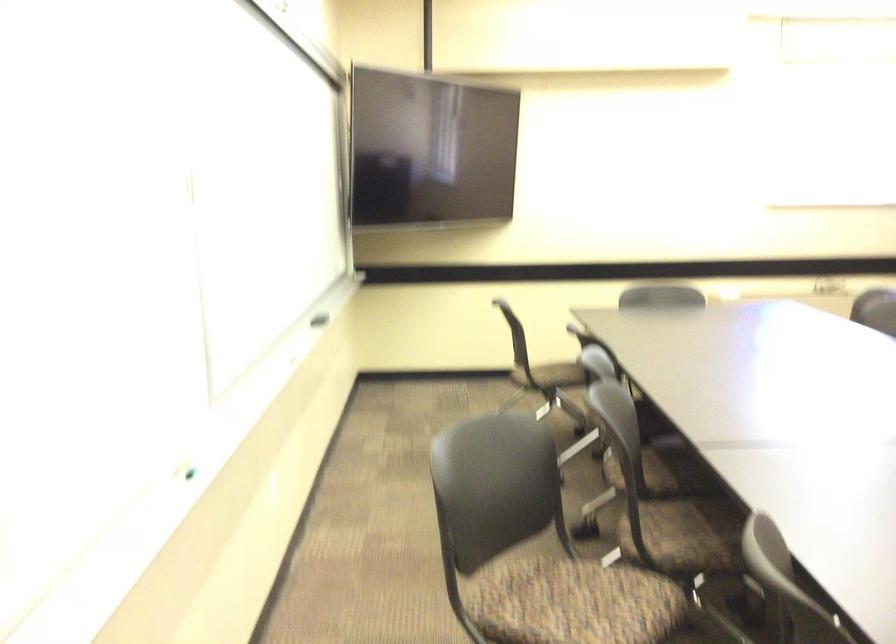
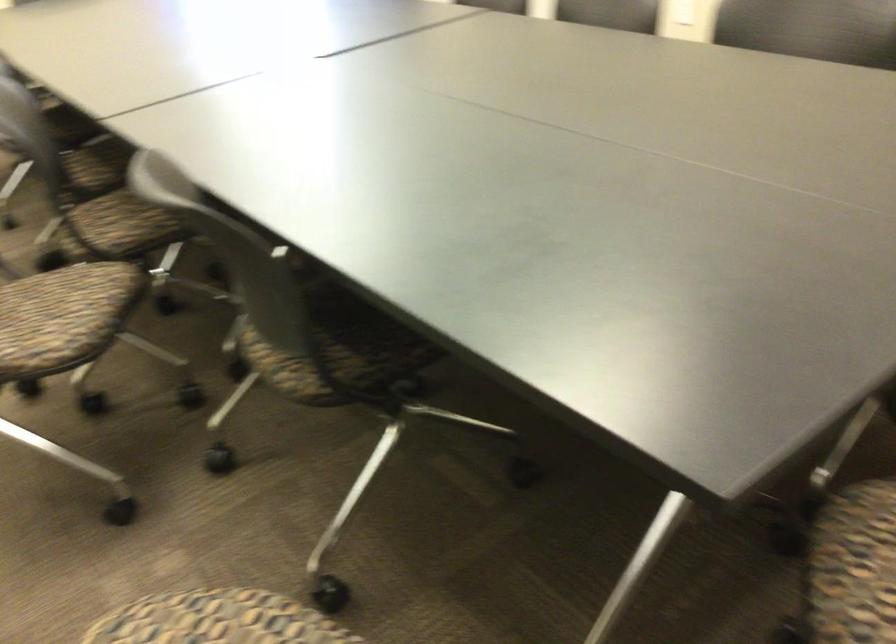
Find the pixel in the second image that matches pixel 665 533 in the first image.

(122, 223)